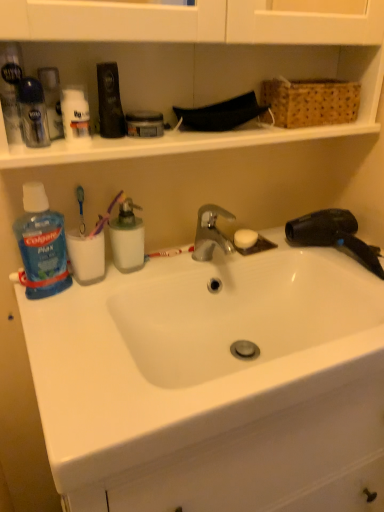
Locate an element on the screen. The width and height of the screenshot is (384, 512). spots to the right of translucent plastic container at center, positioned as the second cleaning product in left-to-right order is located at coordinates (179, 267).